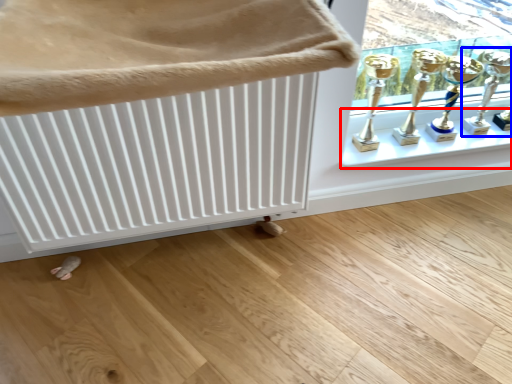
Question: Which object is further to the camera taking this photo, window sill (highlighted by a red box) or candle holder (highlighted by a blue box)?

Choices:
 (A) window sill
 (B) candle holder

Answer: (A)